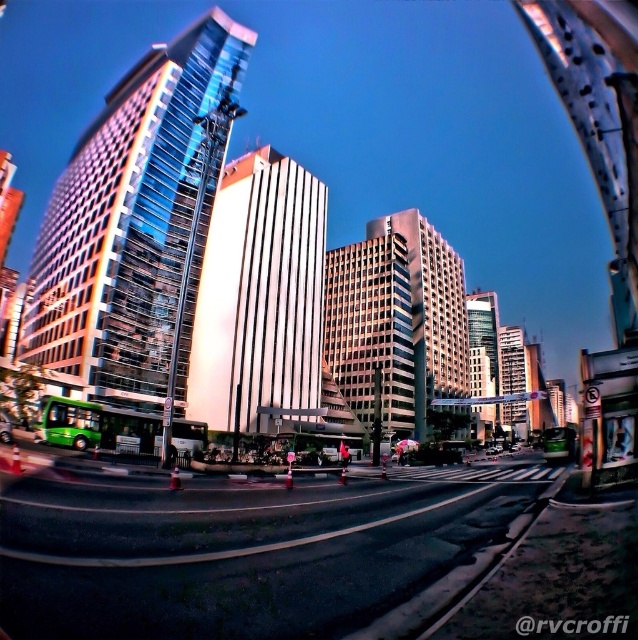
Can you confirm if black asphalt road at center is taller than matte glass building at center?

In fact, black asphalt road at center may be shorter than matte glass building at center.

Can you confirm if black asphalt road at center is smaller than matte glass building at center?

Correct, black asphalt road at center occupies less space than matte glass building at center.

Which is behind, point (285, 630) or point (343, 381)?

The point (343, 381) is more distant.

What are the coordinates of `black asphalt road at center` in the screenshot? It's located at (239, 548).

Can you confirm if white glass building at center is bigger than shiny silver sedan at center?

Yes.

Between point (461, 324) and point (487, 451), which one is positioned in front?

Point (487, 451)

Locate an element on the screen. The image size is (638, 640). white glass building at center is located at coordinates (431, 310).

How far apart are white glossy building at center and shiny silver sedan at center?

The distance of white glossy building at center from shiny silver sedan at center is 92.84 meters.

How far apart are white glossy building at center and shiny silver sedan at center?

92.84 meters

Describe the element at coordinates (260, 298) in the screenshot. The image size is (638, 640). I see `white glossy building at center` at that location.

At what (x,y) coordinates should I click in order to perform the action: click on white glossy building at center. Please return your answer as a coordinate pair (x, y). This screenshot has height=640, width=638. Looking at the image, I should click on (260, 298).